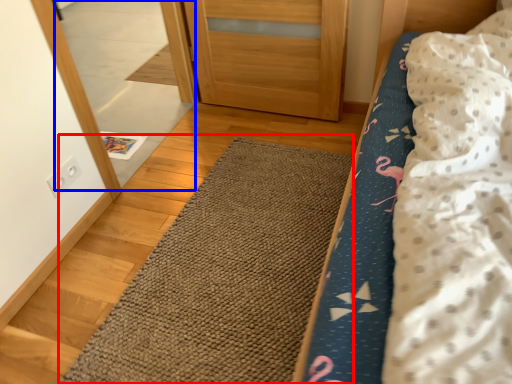
Question: Which of the following is the closest to the observer, doormat (highlighted by a red box) or mirror (highlighted by a blue box)?

Choices:
 (A) doormat
 (B) mirror

Answer: (A)